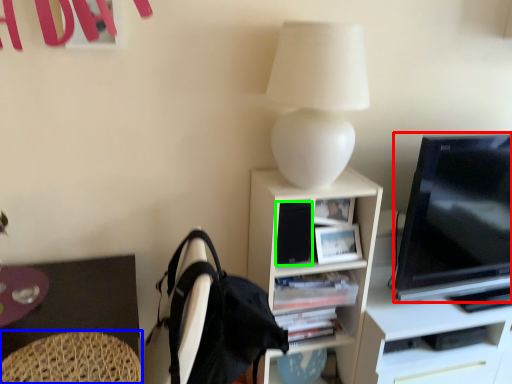
Question: Estimate the real-world distances between objects in this image. Which object is farther from television (highlighted by a red box), swivel chair (highlighted by a blue box) or speaker (highlighted by a green box)?

Choices:
 (A) swivel chair
 (B) speaker

Answer: (A)